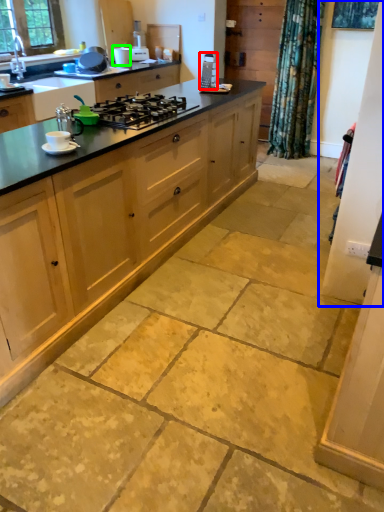
Question: Which is nearer to the appliance (highlighted by a red box)? screen door (highlighted by a blue box) or appliance (highlighted by a green box).

Choices:
 (A) screen door
 (B) appliance

Answer: (B)